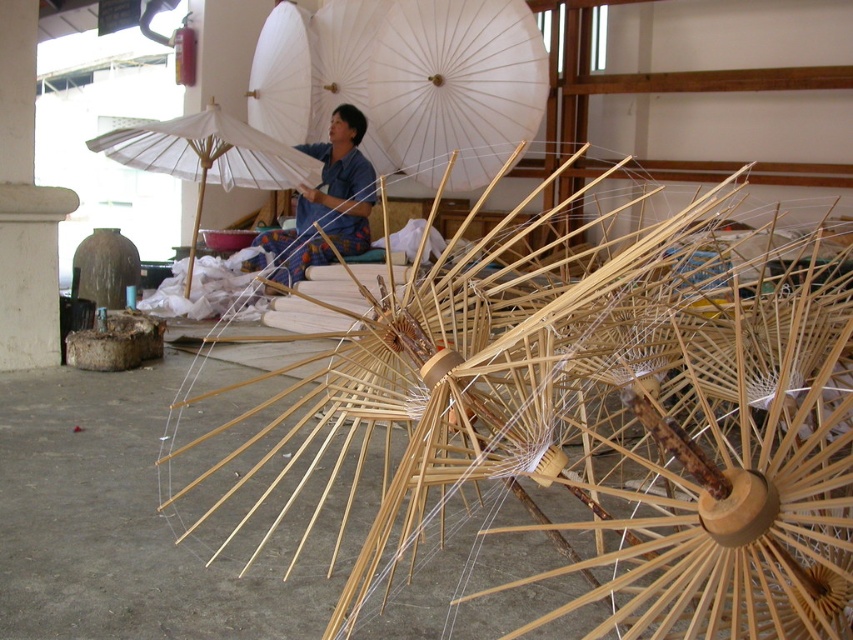
Is point (296, 106) behind point (148, 157)?

Yes, it is behind point (148, 157).

Which of these two, white paper umbrella at center or white paper umbrella at upper center, stands taller?

white paper umbrella at center

Between point (379, 100) and point (194, 163), which one is positioned behind?

Positioned behind is point (194, 163).

In order to click on white paper umbrella at center in this screenshot , I will do `click(405, 81)`.

What do you see at coordinates (207, 156) in the screenshot? I see `white paper umbrella at upper center` at bounding box center [207, 156].

Can you confirm if white paper umbrella at upper center is smaller than blue fabric at center?

No.

I want to click on white paper umbrella at upper center, so click(207, 156).

Find the location of `white paper umbrella at upper center`. white paper umbrella at upper center is located at coordinates (207, 156).

The width and height of the screenshot is (853, 640). What are the coordinates of `white paper umbrella at center` in the screenshot? It's located at (405, 81).

Can you confirm if white paper umbrella at center is positioned to the left of blue fabric at center?

In fact, white paper umbrella at center is to the right of blue fabric at center.

Is point (300, 96) closer to camera compared to point (292, 248)?

No, (300, 96) is behind (292, 248).

Find the location of a particular element. This screenshot has width=853, height=640. white paper umbrella at center is located at coordinates (405, 81).